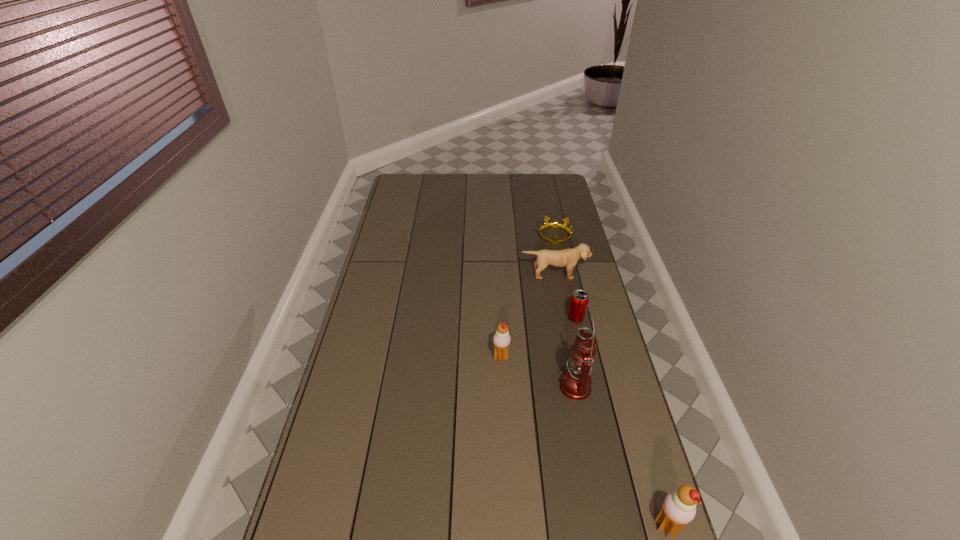
Please show where to add a icecream on the left while keeping spacing even. Please provide its 2D coordinates. Your answer should be formatted as a tuple, i.e. [(x, y)], where the tuple contains the x and y coordinates of a point satisfying the conditions above.

[(405, 260)]